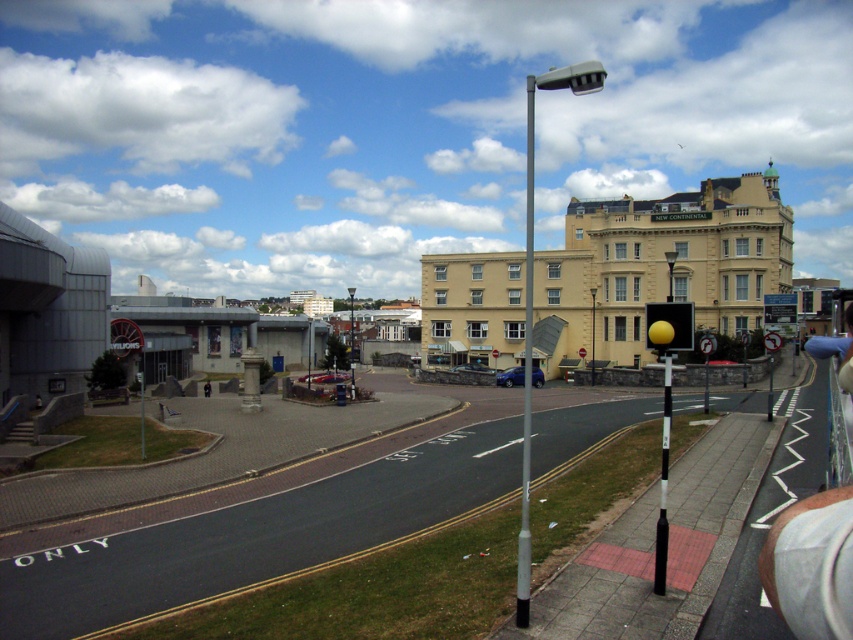
Which is more to the right, yellow matte traffic light at center or metallic pole at center?

yellow matte traffic light at center is more to the right.

Which is in front, point (686, 340) or point (142, 385)?

Point (686, 340) is in front.

Is point (679, 305) positioned behind point (143, 448)?

No, (679, 305) is in front of (143, 448).

Locate an element on the screen. The height and width of the screenshot is (640, 853). yellow matte traffic light at center is located at coordinates (672, 321).

Which of these two, silver metallic pole at center or black plastic pole at right, stands shorter?

Standing shorter between the two is black plastic pole at right.

Does silver metallic pole at center appear on the right side of black plastic pole at right?

Yes, silver metallic pole at center is to the right of black plastic pole at right.

Locate an element on the screen. silver metallic pole at center is located at coordinates (526, 376).

Does point (660, 509) come in front of point (140, 451)?

Yes, point (660, 509) is closer to viewer.

Does black plastic pole at right have a larger size compared to metallic pole at center?

Yes.

Locate an element on the screen. black plastic pole at right is located at coordinates (663, 486).

You are a GUI agent. You are given a task and a screenshot of the screen. Output one action in this format:
    pyautogui.click(x=<x>, y=<y>)
    Task: Click on the black plastic pole at right
    
    Given the screenshot: What is the action you would take?
    pyautogui.click(x=663, y=486)